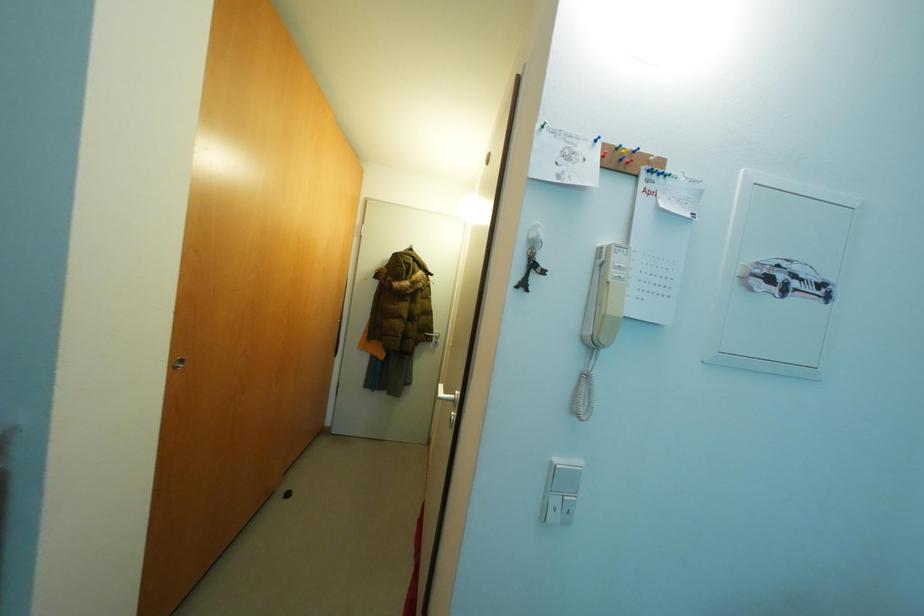
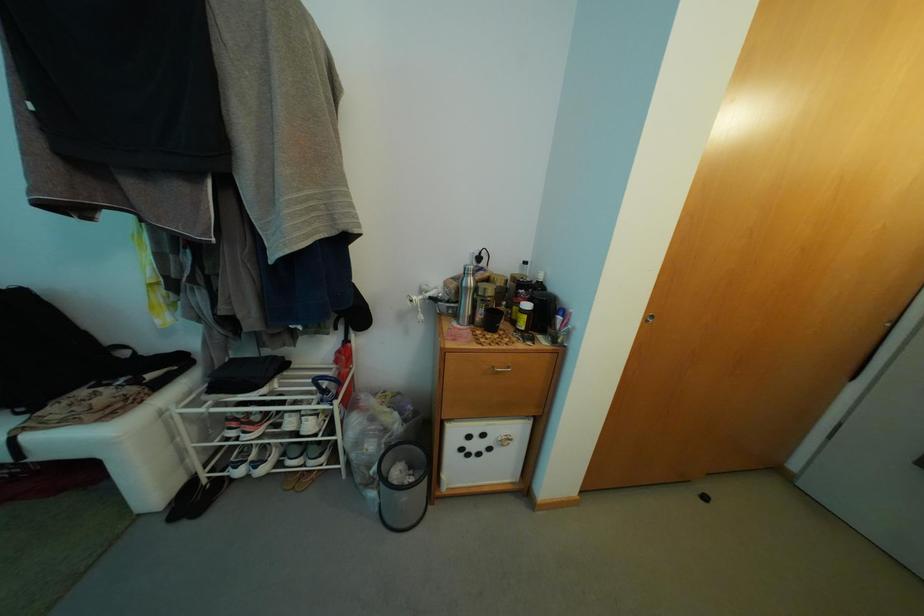
Question: The first image is from the beginning of the video and the second image is from the end. How did the camera likely rotate when shooting the video?

Choices:
 (A) Left
 (B) Right
 (C) Up
 (D) Down

Answer: (A)